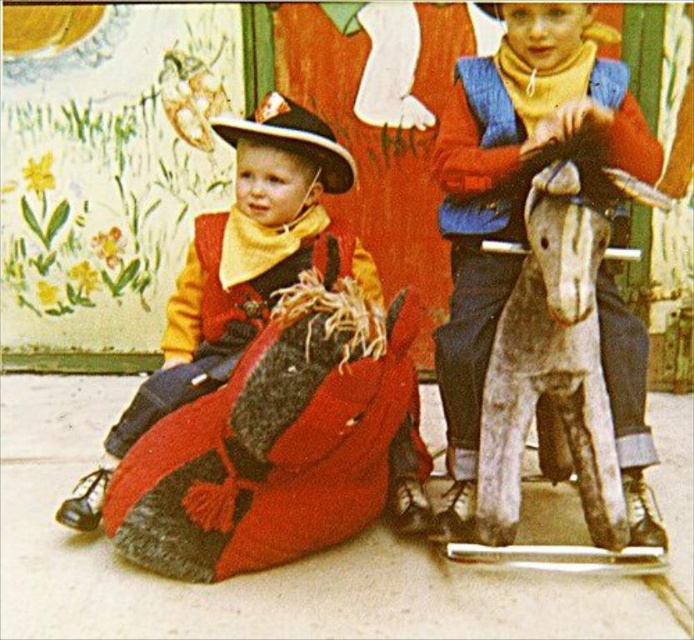
Is wooden rocking horse at center bigger than fuzzy red blanket at lower left?

Correct, wooden rocking horse at center is larger in size than fuzzy red blanket at lower left.

Between wooden rocking horse at center and fuzzy red blanket at lower left, which one appears on the left side from the viewer's perspective?

Positioned to the left is fuzzy red blanket at lower left.

Who is more forward, (459,317) or (158,403)?

Point (459,317) is in front.

The image size is (694, 640). I want to click on wooden rocking horse at center, so click(x=516, y=180).

Find the location of a particular element. fuzzy red blanket at lower left is located at coordinates (237, 272).

Can you confirm if fuzzy red blanket at lower left is bigger than matte brown cowboy hat at center?

Indeed, fuzzy red blanket at lower left has a larger size compared to matte brown cowboy hat at center.

Image resolution: width=694 pixels, height=640 pixels. Describe the element at coordinates (237, 272) in the screenshot. I see `fuzzy red blanket at lower left` at that location.

You are a GUI agent. You are given a task and a screenshot of the screen. Output one action in this format:
    pyautogui.click(x=<x>, y=<y>)
    Task: Click on the fuzzy red blanket at lower left
    This screenshot has height=640, width=694.
    Given the screenshot: What is the action you would take?
    pyautogui.click(x=237, y=272)

Is wooden rocking horse at center thinner than matte brown cowboy hat at center?

In fact, wooden rocking horse at center might be wider than matte brown cowboy hat at center.

Where is `wooden rocking horse at center`? wooden rocking horse at center is located at coordinates (516, 180).

The height and width of the screenshot is (640, 694). I want to click on wooden rocking horse at center, so click(516, 180).